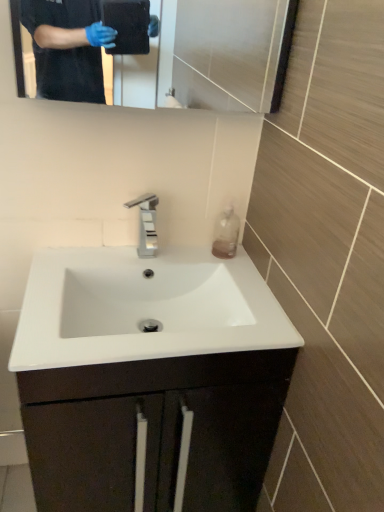
What do you see at coordinates (226, 234) in the screenshot? Image resolution: width=384 pixels, height=512 pixels. I see `translucent plastic bottle at right` at bounding box center [226, 234].

I want to click on white glossy sink at center, so click(154, 430).

What are the coordinates of `translucent plastic bottle at right` in the screenshot? It's located at (226, 234).

From a real-world perspective, which is physically below, glossy metallic mirror at upper center or white glossy sink at center?

white glossy sink at center, from a real-world perspective.

The image size is (384, 512). What are the coordinates of `sink on the left of the glossy metallic mirror at upper center` in the screenshot? It's located at (150, 298).

In terms of width, does glossy metallic mirror at upper center look wider or thinner when compared to white glossy sink at center?

Considering their sizes, glossy metallic mirror at upper center looks slimmer than white glossy sink at center.

Is white glossy sink at center at the back of glossy metallic mirror at upper center?

No, glossy metallic mirror at upper center is not facing the opposite direction of white glossy sink at center.

Which is correct: white glossy sink at center is inside white glossy sink at center, or outside of it?

The correct answer is: outside.

Where is `sink on the right of the white glossy sink at center`? sink on the right of the white glossy sink at center is located at coordinates (150, 298).

Is white glossy sink at center bigger or smaller than white glossy sink at center?

In the image, white glossy sink at center appears to be larger than white glossy sink at center.

You are a GUI agent. You are given a task and a screenshot of the screen. Output one action in this format:
    pyautogui.click(x=<x>, y=<y>)
    Task: Click on the liquid behind the glossy metallic mirror at upper center
    
    Given the screenshot: What is the action you would take?
    pyautogui.click(x=226, y=234)

How distant is glossy metallic mirror at upper center from translucent plastic bottle at right?

The distance of glossy metallic mirror at upper center from translucent plastic bottle at right is 19.77 inches.

Is glossy metallic mirror at upper center wider or thinner than translucent plastic bottle at right?

In the image, glossy metallic mirror at upper center appears to be wider than translucent plastic bottle at right.

Choose the correct answer: Is glossy metallic mirror at upper center inside translucent plastic bottle at right or outside it?

glossy metallic mirror at upper center is outside translucent plastic bottle at right.

Is white glossy sink at center spatially inside translucent plastic bottle at right, or outside of it?

The correct answer is: outside.

From a real-world perspective, who is located lower, white glossy sink at center or translucent plastic bottle at right?

From a 3D spatial view, white glossy sink at center is below.

Would you consider white glossy sink at center to be distant from translucent plastic bottle at right?

white glossy sink at center is near translucent plastic bottle at right, not far away.

This screenshot has height=512, width=384. Identify the location of liquid above the white glossy sink at center (from the image's perspective). (226, 234).

Is there a large distance between white glossy sink at center and glossy metallic mirror at upper center?

They are positioned close to each other.

Who is taller, white glossy sink at center or glossy metallic mirror at upper center?

glossy metallic mirror at upper center is taller.

Could you tell me if white glossy sink at center is turned towards glossy metallic mirror at upper center?

No, white glossy sink at center is not turned towards glossy metallic mirror at upper center.

The image size is (384, 512). What are the coordinates of `sink below the glossy metallic mirror at upper center (from the image's perspective)` in the screenshot? It's located at (150, 298).

Is white glossy sink at center shorter than translucent plastic bottle at right?

In fact, white glossy sink at center may be taller than translucent plastic bottle at right.

Is white glossy sink at center with translucent plastic bottle at right?

There is a gap between white glossy sink at center and translucent plastic bottle at right.

In terms of width, does white glossy sink at center look wider or thinner when compared to translucent plastic bottle at right?

In the image, white glossy sink at center appears to be wider than translucent plastic bottle at right.

Find the location of a particular element. Image resolution: width=384 pixels, height=512 pixels. bathroom cabinet in front of the translucent plastic bottle at right is located at coordinates (154, 430).

Does glossy metallic mirror at upper center have a greater height compared to white glossy sink at center?

In fact, glossy metallic mirror at upper center may be shorter than white glossy sink at center.

Is glossy metallic mirror at upper center to the left of white glossy sink at center from the viewer's perspective?

Incorrect, glossy metallic mirror at upper center is not on the left side of white glossy sink at center.

Is glossy metallic mirror at upper center completely or partially outside of white glossy sink at center?

Indeed, glossy metallic mirror at upper center is completely outside white glossy sink at center.

Is glossy metallic mirror at upper center wider than white glossy sink at center?

In fact, glossy metallic mirror at upper center might be narrower than white glossy sink at center.

Find the location of a particular element. The image size is (384, 512). mirror in front of the white glossy sink at center is located at coordinates (162, 48).

Where is `bathroom cabinet on the left of the white glossy sink at center`? This screenshot has height=512, width=384. bathroom cabinet on the left of the white glossy sink at center is located at coordinates (154, 430).

Based on their spatial positions, is glossy metallic mirror at upper center or white glossy sink at center further from translucent plastic bottle at right?

white glossy sink at center is further to translucent plastic bottle at right.

Estimate the real-world distances between objects in this image. Which object is closer to glossy metallic mirror at upper center, white glossy sink at center or white glossy sink at center?

white glossy sink at center.

Estimate the real-world distances between objects in this image. Which object is closer to glossy metallic mirror at upper center, translucent plastic bottle at right or white glossy sink at center?

translucent plastic bottle at right lies closer to glossy metallic mirror at upper center than the other object.

Estimate the real-world distances between objects in this image. Which object is closer to translucent plastic bottle at right, glossy metallic mirror at upper center or white glossy sink at center?

Among the two, white glossy sink at center is located nearer to translucent plastic bottle at right.

Looking at the image, which one is located closer to white glossy sink at center, glossy metallic mirror at upper center or translucent plastic bottle at right?

Among the two, translucent plastic bottle at right is located nearer to white glossy sink at center.

Based on their spatial positions, is glossy metallic mirror at upper center or white glossy sink at center further from white glossy sink at center?

glossy metallic mirror at upper center.

Based on their spatial positions, is white glossy sink at center or white glossy sink at center closer to translucent plastic bottle at right?

white glossy sink at center is positioned closer to the anchor translucent plastic bottle at right.

Based on their spatial positions, is translucent plastic bottle at right or glossy metallic mirror at upper center further from white glossy sink at center?

The object further to white glossy sink at center is glossy metallic mirror at upper center.

Image resolution: width=384 pixels, height=512 pixels. In order to click on liquid between glossy metallic mirror at upper center and white glossy sink at center in the vertical direction in this screenshot , I will do `click(226, 234)`.

Identify the location of sink that lies between glossy metallic mirror at upper center and white glossy sink at center from top to bottom. (150, 298).

Find the location of a particular element. The image size is (384, 512). sink between translucent plastic bottle at right and white glossy sink at center in the up-down direction is located at coordinates (x=150, y=298).

Locate an element on the screen. Image resolution: width=384 pixels, height=512 pixels. liquid between glossy metallic mirror at upper center and white glossy sink at center in the up-down direction is located at coordinates click(x=226, y=234).